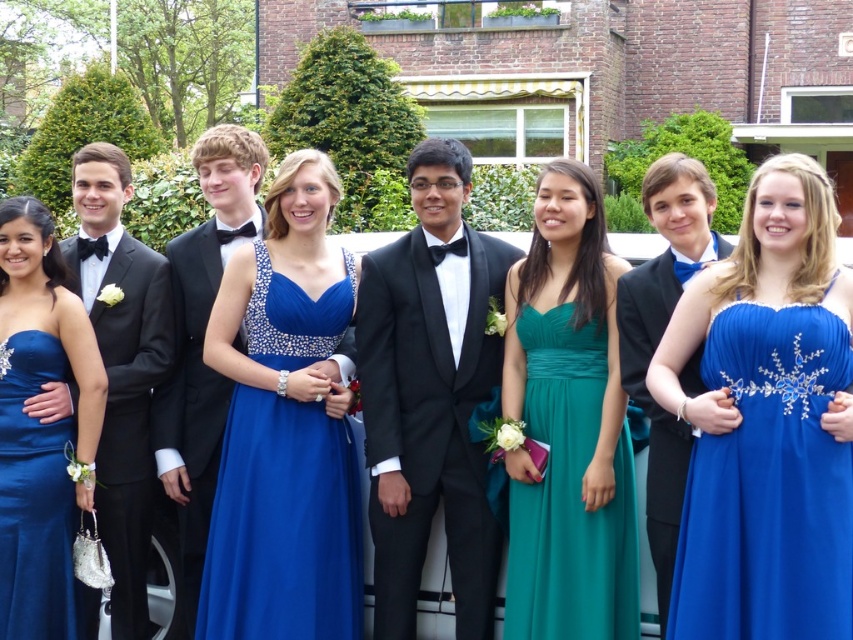
Is shiny blue dress at center to the left of black satin tuxedo at left from the viewer's perspective?

Incorrect, shiny blue dress at center is not on the left side of black satin tuxedo at left.

Who is positioned more to the left, shiny blue dress at center or black satin tuxedo at left?

black satin tuxedo at left

Is point (350, 584) closer to camera compared to point (119, 228)?

Yes, point (350, 584) is closer to viewer.

Find the location of a particular element. shiny blue dress at center is located at coordinates (283, 524).

Who is positioned more to the right, shiny blue dress at center or matte black suit at center?

Positioned to the right is matte black suit at center.

Which is behind, point (283, 476) or point (680, 477)?

The point (283, 476) is more distant.

Which is behind, point (230, 433) or point (672, 435)?

Positioned behind is point (230, 433).

The width and height of the screenshot is (853, 640). In order to click on shiny blue dress at center in this screenshot , I will do `click(283, 524)`.

Can you confirm if black satin tuxedo at center is shorter than royal blue satin dress at center?

Correct, black satin tuxedo at center is not as tall as royal blue satin dress at center.

Does point (440, 298) come behind point (798, 545)?

Yes, it is behind point (798, 545).

Identify the location of black satin tuxedo at center. (430, 394).